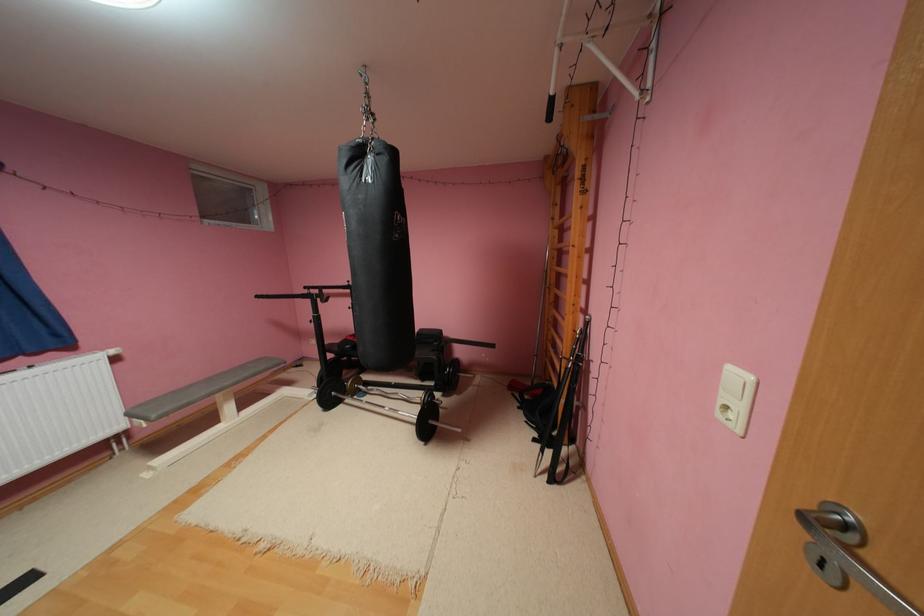
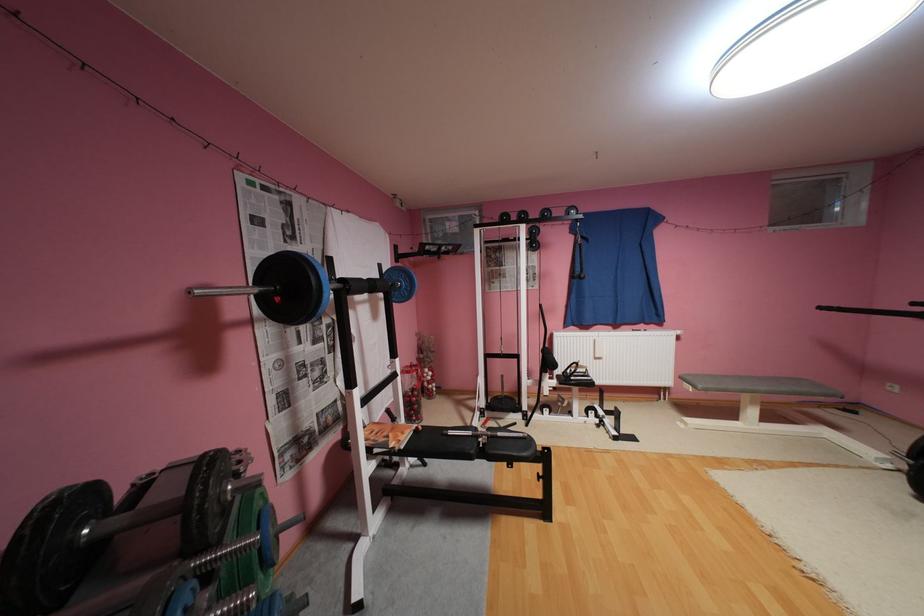
Where in the second image is the point corresponding to [236,383] from the first image?

(771, 387)